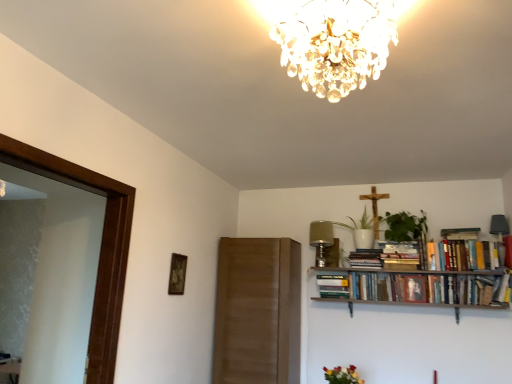
Question: Would you say vibrant bouquet at lower center is to the left or to the right of hardcover books at upper right, the 2th book in the left-to-right sequence, in the picture?

Choices:
 (A) left
 (B) right

Answer: (A)

Question: Choose the correct answer: Is vibrant bouquet at lower center inside hardcover books at upper right, the 2th book in the left-to-right sequence, or outside it?

Choices:
 (A) outside
 (B) inside

Answer: (A)

Question: Estimate the real-world distances between objects in this image. Which object is farther from the crystal glass chandelier at upper center?

Choices:
 (A) green leafy plant at upper right, the second plant viewed from the left
 (B) vibrant bouquet at lower center
 (C) hardcover books at upper right, the 1th book viewed from the right
 (D) hardcover books at upper right, the 2th book in the left-to-right sequence
 (E) wooden picture frame at upper left

Answer: (D)

Question: Which is farther from the green leafy plant at upper right, the first plant viewed from the right?

Choices:
 (A) vibrant bouquet at lower center
 (B) hardcover book at upper center, the 1th book viewed from the left
 (C) hardcover books at right, positioned as the 2th book in right-to-left order
 (D) white ceramic vase at upper center, arranged as the second plant when viewed from the right
 (E) wooden crucifix at upper center

Answer: (A)